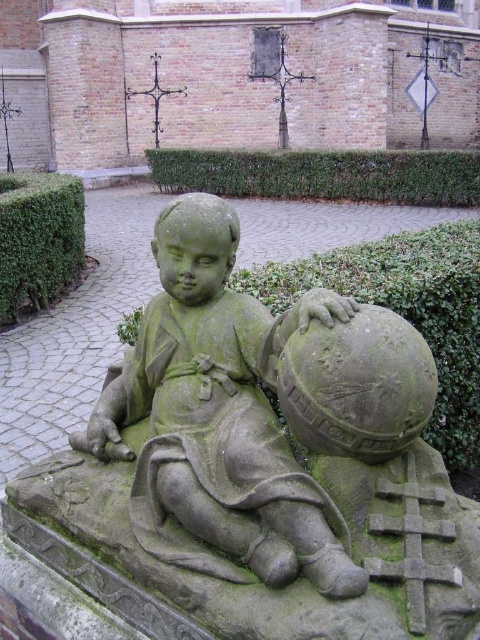
Does green mossy hedge at center appear on the left side of green hedge at center?

In fact, green mossy hedge at center is to the right of green hedge at center.

Which is below, green mossy hedge at center or green hedge at center?

green mossy hedge at center

Does point (300, 273) come in front of point (321, 154)?

Yes, it is.

This screenshot has height=640, width=480. Find the location of `green mossy hedge at center`. green mossy hedge at center is located at coordinates (407, 310).

Is green stone statue at center positioned behind green mossy hedge at center?

No, green stone statue at center is in front of green mossy hedge at center.

Does point (176, 416) lie behind point (471, 320)?

That is False.

Does point (309, 550) come farther from viewer compared to point (422, 330)?

That is False.

I want to click on green stone statue at center, so click(x=218, y=419).

Is green stone statue at center to the right of green hedge at center from the viewer's perspective?

Incorrect, green stone statue at center is not on the right side of green hedge at center.

Describe the element at coordinates (218, 419) in the screenshot. I see `green stone statue at center` at that location.

This screenshot has height=640, width=480. I want to click on green stone statue at center, so click(218, 419).